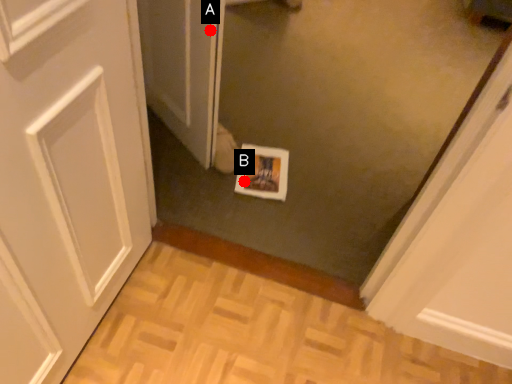
Question: Two points are circled on the image, labeled by A and B beside each circle. Which point is closer to the camera?

Choices:
 (A) A is closer
 (B) B is closer

Answer: (A)